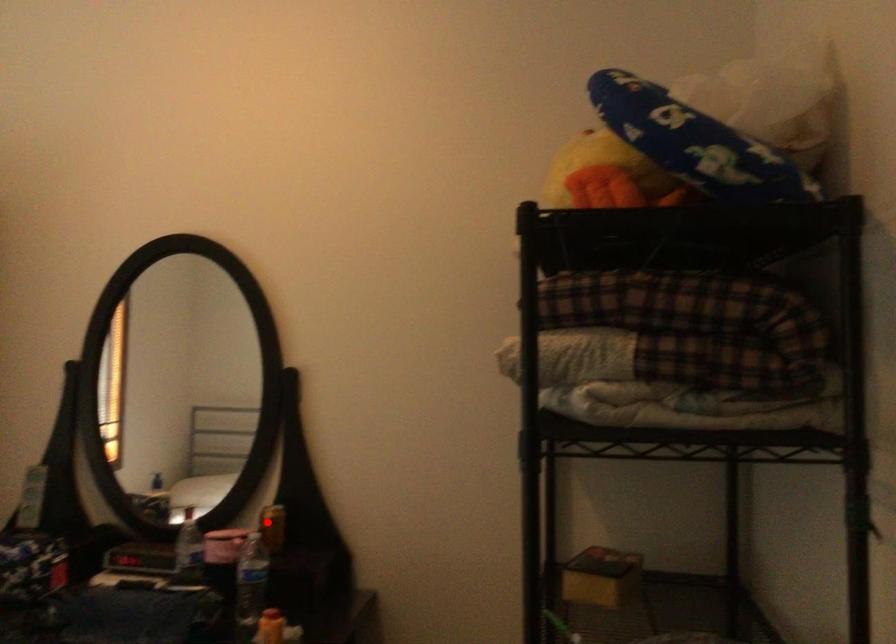
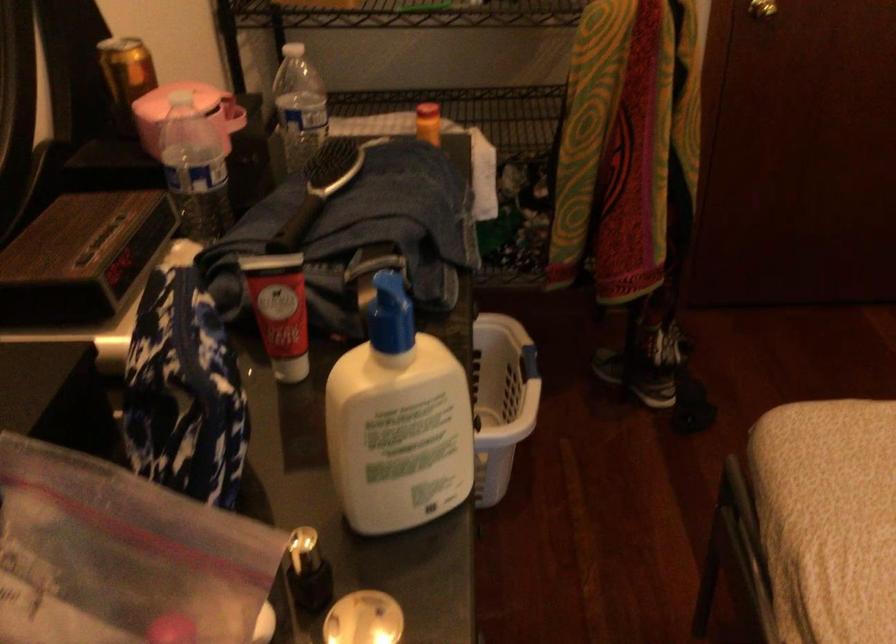
Question: I am providing you with two images of the same scene from different viewpoints. Given a red point in image1, look at the same physical point in image2. Is it:

Choices:
 (A) Closer to the viewpoint
 (B) Farther from the viewpoint

Answer: (A)